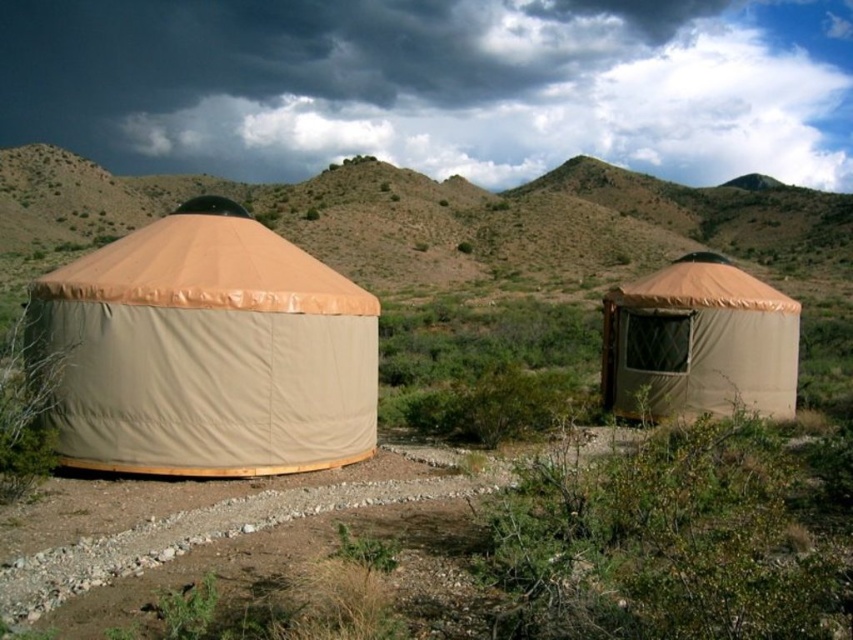
Question: Is brown textured tent at upper center to the left of tan canvas yurt at right from the viewer's perspective?

Choices:
 (A) no
 (B) yes

Answer: (B)

Question: Is tan canvas yurt at left above brown textured tent at upper center?

Choices:
 (A) yes
 (B) no

Answer: (B)

Question: Can you confirm if tan canvas yurt at left is positioned above brown textured tent at upper center?

Choices:
 (A) yes
 (B) no

Answer: (B)

Question: Which object is positioned closest to the tan canvas yurt at right?

Choices:
 (A) brown textured tent at upper center
 (B) tan canvas yurt at left

Answer: (B)

Question: Which point appears closest to the camera in this image?

Choices:
 (A) (740, 317)
 (B) (287, 428)
 (C) (412, 276)

Answer: (B)

Question: Which of these objects is positioned closest to the brown textured tent at upper center?

Choices:
 (A) tan canvas yurt at right
 (B) tan canvas yurt at left

Answer: (B)